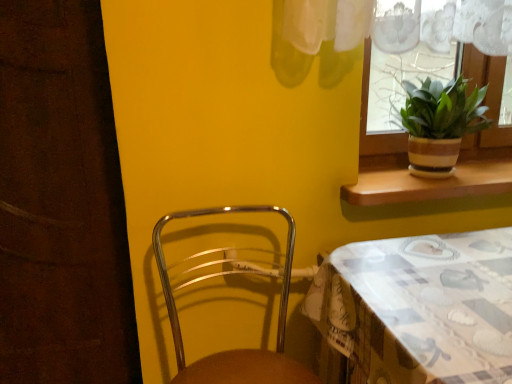
Question: In terms of size, does metallic brown chair at lower left appear bigger or smaller than brown wood at upper right?

Choices:
 (A) big
 (B) small

Answer: (A)

Question: In terms of height, does metallic brown chair at lower left look taller or shorter compared to brown wood at upper right?

Choices:
 (A) short
 (B) tall

Answer: (B)

Question: Which object is the farthest from the metallic brown chair at lower left?

Choices:
 (A) patterned fabric table at lower right
 (B) green striped pot at window
 (C) brown wood at upper right

Answer: (B)

Question: Which object is positioned farthest from the brown wood at upper right?

Choices:
 (A) patterned fabric table at lower right
 (B) metallic brown chair at lower left
 (C) green striped pot at window

Answer: (B)